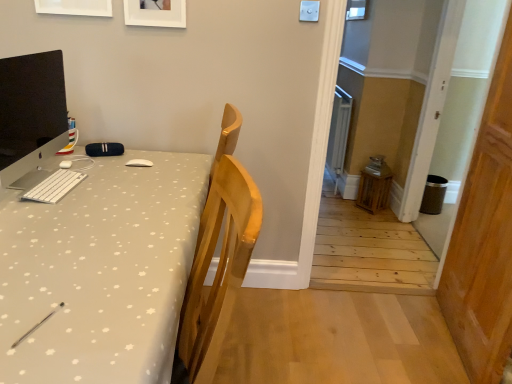
Question: Can you confirm if white matte picture frame at upper center, the first picture frame from the left, is wider than white fabric desk at left?

Choices:
 (A) no
 (B) yes

Answer: (A)

Question: Is the depth of white matte picture frame at upper center, arranged as the second picture frame when viewed from the right, greater than that of white fabric desk at left?

Choices:
 (A) no
 (B) yes

Answer: (B)

Question: Considering the relative sizes of white matte picture frame at upper center, arranged as the second picture frame when viewed from the right, and white fabric desk at left in the image provided, is white matte picture frame at upper center, arranged as the second picture frame when viewed from the right, taller than white fabric desk at left?

Choices:
 (A) no
 (B) yes

Answer: (A)

Question: Does white matte picture frame at upper center, arranged as the second picture frame when viewed from the right, appear on the right side of white fabric desk at left?

Choices:
 (A) yes
 (B) no

Answer: (B)

Question: Is white fabric desk at left at the back of white matte picture frame at upper center, the first picture frame from the left?

Choices:
 (A) no
 (B) yes

Answer: (A)

Question: Is white matte picture frame at upper center, the first picture frame from the left, not near white fabric desk at left?

Choices:
 (A) yes
 (B) no

Answer: (A)

Question: From a real-world perspective, is white matte keyboard at left below wooden door at right?

Choices:
 (A) no
 (B) yes

Answer: (A)

Question: Is white matte keyboard at left oriented towards wooden door at right?

Choices:
 (A) no
 (B) yes

Answer: (B)

Question: Is white matte keyboard at left oriented away from wooden door at right?

Choices:
 (A) yes
 (B) no

Answer: (B)

Question: From the image's perspective, does white matte keyboard at left appear higher than wooden door at right?

Choices:
 (A) yes
 (B) no

Answer: (A)

Question: Is white matte keyboard at left bigger than wooden door at right?

Choices:
 (A) no
 (B) yes

Answer: (A)

Question: Is white matte keyboard at left touching wooden door at right?

Choices:
 (A) no
 (B) yes

Answer: (A)

Question: From a real-world perspective, is white fabric desk at left beneath white matte keyboard at left?

Choices:
 (A) no
 (B) yes

Answer: (B)